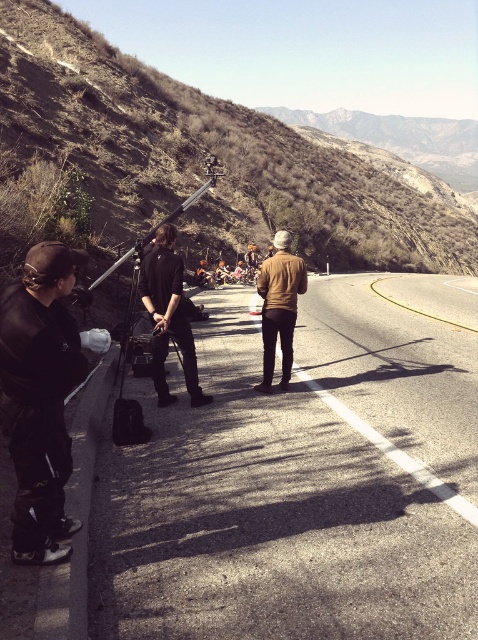
The height and width of the screenshot is (640, 478). What do you see at coordinates (169, 316) in the screenshot? I see `black leather jacket at center` at bounding box center [169, 316].

Between point (181, 326) and point (295, 305), which one is positioned in front?

Positioned in front is point (181, 326).

This screenshot has height=640, width=478. I want to click on black leather jacket at center, so click(x=169, y=316).

Measure the distance between smooth asphalt highway at center and matte black jacket at left.

They are 3.00 meters apart.

Does point (417, 392) come behind point (31, 378)?

That is True.

Who is more forward, (324, 404) or (34, 349)?

Point (34, 349) is in front.

This screenshot has height=640, width=478. I want to click on smooth asphalt highway at center, so click(297, 486).

What do you see at coordinates (297, 486) in the screenshot? I see `smooth asphalt highway at center` at bounding box center [297, 486].

Based on the photo, measure the distance between smooth asphalt highway at center and camera.

smooth asphalt highway at center is 9.57 feet from camera.

Where is `smooth asphalt highway at center`? smooth asphalt highway at center is located at coordinates (297, 486).